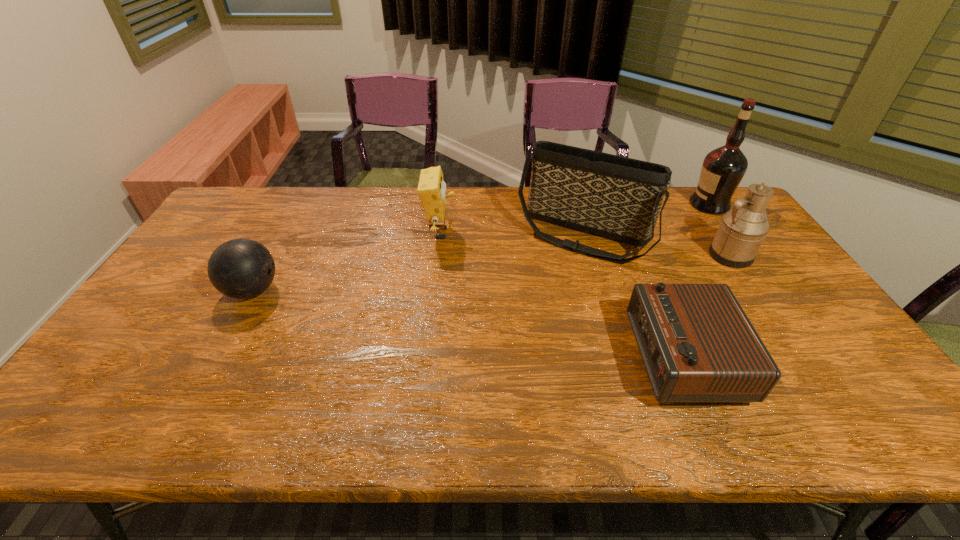
In the image, there is a desktop. Identify the location of blank space at the near left corner. (56, 416).

The height and width of the screenshot is (540, 960). In the image, there is a desktop. Identify the location of vacant space at the near right corner. (832, 403).

Locate an element on the screen. free space between the pitcher and the handbag is located at coordinates (656, 245).

You are a GUI agent. You are given a task and a screenshot of the screen. Output one action in this format:
    pyautogui.click(x=<x>, y=<y>)
    Task: Click on the vacant area that lies between the handbag and the leftmost object
    This screenshot has height=540, width=960.
    Given the screenshot: What is the action you would take?
    pyautogui.click(x=418, y=263)

Image resolution: width=960 pixels, height=540 pixels. In order to click on empty space between the bowling ball and the liquor in this screenshot , I will do `click(481, 248)`.

Where is `vacant area between the tallest object and the radio receiver`? vacant area between the tallest object and the radio receiver is located at coordinates (696, 281).

Locate an element on the screen. This screenshot has width=960, height=540. blank region between the pitcher and the handbag is located at coordinates (656, 245).

Locate an element on the screen. The width and height of the screenshot is (960, 540). vacant space that's between the nearest object and the sponge is located at coordinates (562, 295).

Image resolution: width=960 pixels, height=540 pixels. Find the location of `free spot between the handbag and the fifth object from right to left`. free spot between the handbag and the fifth object from right to left is located at coordinates (511, 234).

Where is `object that is the third closest to the bowling ball`? object that is the third closest to the bowling ball is located at coordinates (697, 344).